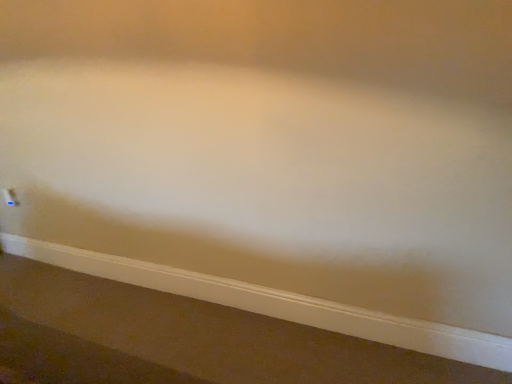
Question: Does white smooth baseboard at lower center appear on the left side of white plastic electric outlet at lower left?

Choices:
 (A) no
 (B) yes

Answer: (A)

Question: Is the position of white smooth baseboard at lower center more distant than that of white plastic electric outlet at lower left?

Choices:
 (A) no
 (B) yes

Answer: (A)

Question: Considering the relative sizes of white smooth baseboard at lower center and white plastic electric outlet at lower left in the image provided, is white smooth baseboard at lower center wider than white plastic electric outlet at lower left?

Choices:
 (A) no
 (B) yes

Answer: (B)

Question: From the image's perspective, does white smooth baseboard at lower center appear lower than white plastic electric outlet at lower left?

Choices:
 (A) no
 (B) yes

Answer: (B)

Question: Can you confirm if white smooth baseboard at lower center is smaller than white plastic electric outlet at lower left?

Choices:
 (A) no
 (B) yes

Answer: (A)

Question: Is white smooth baseboard at lower center facing away from white plastic electric outlet at lower left?

Choices:
 (A) no
 (B) yes

Answer: (A)

Question: Is white plastic electric outlet at lower left to the right of white smooth baseboard at lower center from the viewer's perspective?

Choices:
 (A) yes
 (B) no

Answer: (B)

Question: Is white smooth baseboard at lower center at the back of white plastic electric outlet at lower left?

Choices:
 (A) no
 (B) yes

Answer: (A)

Question: Are white plastic electric outlet at lower left and white smooth baseboard at lower center located far from each other?

Choices:
 (A) yes
 (B) no

Answer: (A)

Question: Does white plastic electric outlet at lower left lie in front of white smooth baseboard at lower center?

Choices:
 (A) no
 (B) yes

Answer: (A)

Question: From a real-world perspective, is white plastic electric outlet at lower left on white smooth baseboard at lower center?

Choices:
 (A) yes
 (B) no

Answer: (A)

Question: From the image's perspective, does white plastic electric outlet at lower left appear higher than white smooth baseboard at lower center?

Choices:
 (A) yes
 (B) no

Answer: (A)

Question: Considering their positions, is white smooth baseboard at lower center located in front of or behind white plastic electric outlet at lower left?

Choices:
 (A) front
 (B) behind

Answer: (A)